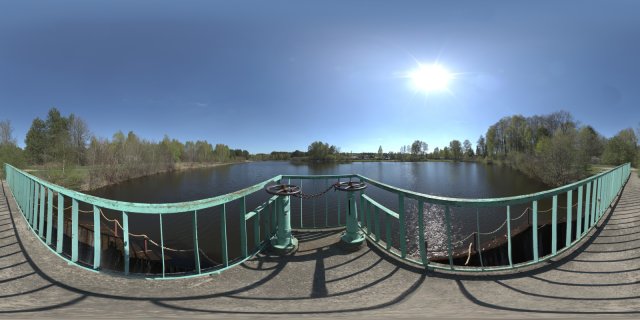
What are the coordinates of `straight railing` in the screenshot? It's located at (316, 176).